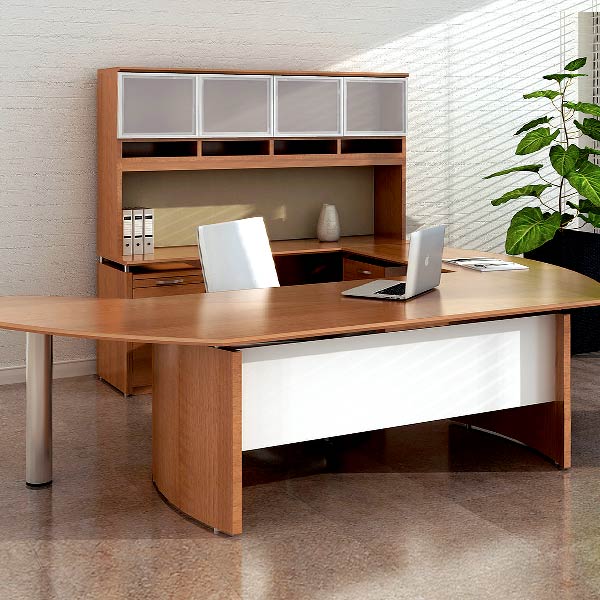
Locate an element on the screen. The width and height of the screenshot is (600, 600). empty space on desk is located at coordinates (231, 325).